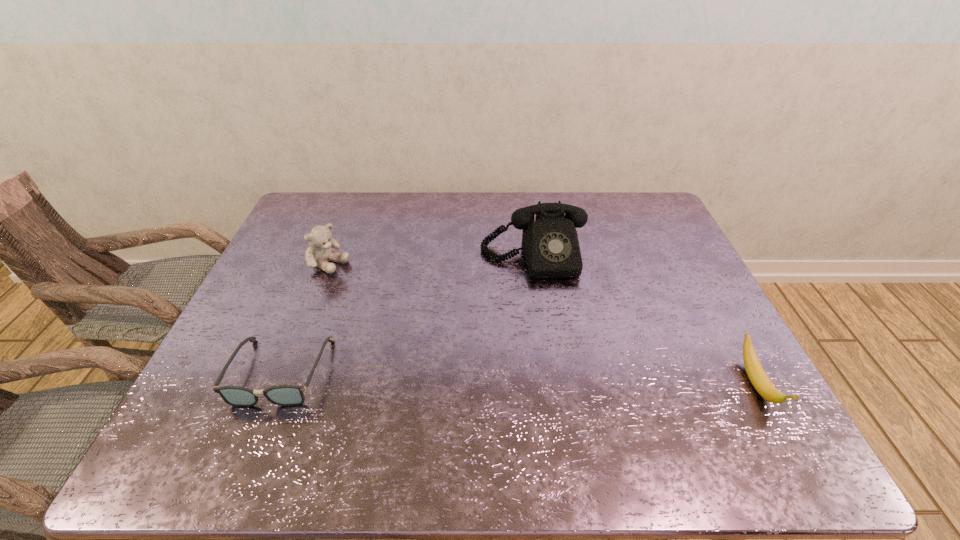
I want to click on free space on the desktop that is between the spectacles and the rightmost object and is positioned on the dial of the third object from left to right, so click(560, 379).

I want to click on vacant space on the desktop that is between the spectacles and the rightmost object and is positioned on the face of the teddy bear, so click(x=545, y=379).